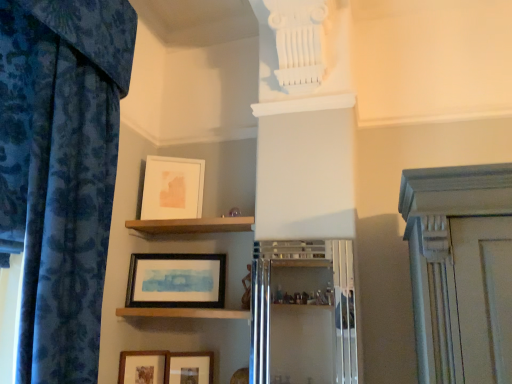
This screenshot has height=384, width=512. Describe the element at coordinates (190, 368) in the screenshot. I see `wooden framed picture at lower center, positioned as the 3th picture frame in top-to-bottom order` at that location.

You are a GUI agent. You are given a task and a screenshot of the screen. Output one action in this format:
    pyautogui.click(x=<x>, y=<y>)
    Task: Click on the wooden framed picture at lower center, positioned as the 3th picture frame in top-to-bottom order
    The height and width of the screenshot is (384, 512).
    Given the screenshot: What is the action you would take?
    pyautogui.click(x=190, y=368)

Identify the location of wooden shelf at center, arranged as the 2th shelf when viewed from the top. The height and width of the screenshot is (384, 512). (184, 313).

What do you see at coordinates (172, 188) in the screenshot? The image size is (512, 384). I see `matte white picture frame at upper center, the fourth picture frame positioned from the bottom` at bounding box center [172, 188].

What do you see at coordinates (143, 367) in the screenshot? The image size is (512, 384). I see `wooden matte picture frame at lower left, the first picture frame when ordered from bottom to top` at bounding box center [143, 367].

Describe the element at coordinates (176, 281) in the screenshot. The width and height of the screenshot is (512, 384). I see `black matte picture frame at lower center, the 3th picture frame ordered from the bottom` at that location.

Locate an element on the screen. The image size is (512, 384). blue floral fabric curtain at left is located at coordinates (61, 171).

Where is `wooden framed picture at lower center, positioned as the 3th picture frame in top-to-bottom order`? wooden framed picture at lower center, positioned as the 3th picture frame in top-to-bottom order is located at coordinates (190, 368).

Where is `curtain to the left of wooden matte picture frame at lower left, the 4th picture frame when ordered from top to bottom`? This screenshot has height=384, width=512. curtain to the left of wooden matte picture frame at lower left, the 4th picture frame when ordered from top to bottom is located at coordinates (61, 171).

Is there a large distance between wooden matte picture frame at lower left, the 4th picture frame when ordered from top to bottom, and blue floral fabric curtain at left?

No, wooden matte picture frame at lower left, the 4th picture frame when ordered from top to bottom, is not far away from blue floral fabric curtain at left.

Is wooden matte picture frame at lower left, the 4th picture frame when ordered from top to bottom, turned away from blue floral fabric curtain at left?

No, wooden matte picture frame at lower left, the 4th picture frame when ordered from top to bottom, is not facing the opposite direction of blue floral fabric curtain at left.

From the image's perspective, which object appears higher, wooden matte picture frame at lower left, the first picture frame when ordered from bottom to top, or blue floral fabric curtain at left?

blue floral fabric curtain at left, from the image's perspective.

Does point (117, 38) come in front of point (226, 316)?

Yes.

From a real-world perspective, is blue floral fabric curtain at left physically above wooden shelf at center, arranged as the 2th shelf when viewed from the top?

Yes, from a real-world perspective, blue floral fabric curtain at left is on top of wooden shelf at center, arranged as the 2th shelf when viewed from the top.

Considering the relative sizes of blue floral fabric curtain at left and wooden shelf at center, arranged as the 2th shelf when viewed from the top, in the image provided, is blue floral fabric curtain at left wider than wooden shelf at center, arranged as the 2th shelf when viewed from the top,?

Indeed, blue floral fabric curtain at left has a greater width compared to wooden shelf at center, arranged as the 2th shelf when viewed from the top.

Is blue floral fabric curtain at left touching wooden shelf at center, marked as the 1th shelf in a bottom-to-top arrangement?

No, blue floral fabric curtain at left is not next to wooden shelf at center, marked as the 1th shelf in a bottom-to-top arrangement.

Consider the image. Is blue floral fabric curtain at left turned away from metallic silver cabinet at center?

No.

From a real-world perspective, is blue floral fabric curtain at left positioned over metallic silver cabinet at center based on gravity?

Yes.

In the image, there is a blue floral fabric curtain at left. In order to click on cabinetry below it (from the image's perspective) in this screenshot , I will do `click(303, 313)`.

Considering their positions, is blue floral fabric curtain at left located in front of or behind metallic silver cabinet at center?

blue floral fabric curtain at left is in front of metallic silver cabinet at center.

Is black matte picture frame at lower center, which is counted as the 2th picture frame, starting from the top, smaller than metallic silver cabinet at center?

Indeed, black matte picture frame at lower center, which is counted as the 2th picture frame, starting from the top, has a smaller size compared to metallic silver cabinet at center.

Considering the relative sizes of black matte picture frame at lower center, which is counted as the 2th picture frame, starting from the top, and metallic silver cabinet at center in the image provided, is black matte picture frame at lower center, which is counted as the 2th picture frame, starting from the top, thinner than metallic silver cabinet at center?

In fact, black matte picture frame at lower center, which is counted as the 2th picture frame, starting from the top, might be wider than metallic silver cabinet at center.

From the image's perspective, relative to metallic silver cabinet at center, is black matte picture frame at lower center, the 3th picture frame ordered from the bottom, above or below?

black matte picture frame at lower center, the 3th picture frame ordered from the bottom, is above metallic silver cabinet at center.

Which object is further away from the camera, black matte picture frame at lower center, the 3th picture frame ordered from the bottom, or metallic silver cabinet at center?

black matte picture frame at lower center, the 3th picture frame ordered from the bottom, is behind.

You are a GUI agent. You are given a task and a screenshot of the screen. Output one action in this format:
    pyautogui.click(x=<x>, y=<y>)
    Task: Click on the shelf that is the 2nd object to the left of the metallic silver cabinet at center, starting at the anchor
    
    Given the screenshot: What is the action you would take?
    pyautogui.click(x=184, y=313)

Is point (167, 315) behind point (332, 244)?

Yes, point (167, 315) is farther from viewer.

From a real-world perspective, between wooden shelf at center, arranged as the 2th shelf when viewed from the top, and metallic silver cabinet at center, who is vertically higher?

In real-world perspective, metallic silver cabinet at center is above.

Could you measure the distance between wooden shelf at center, arranged as the 2th shelf when viewed from the top, and metallic silver cabinet at center?

wooden shelf at center, arranged as the 2th shelf when viewed from the top, and metallic silver cabinet at center are 13.30 inches apart.

Which object is positioned more to the right, black matte picture frame at lower center, which is counted as the 2th picture frame, starting from the top, or wooden matte picture frame at lower left, the 4th picture frame when ordered from top to bottom?

Positioned to the right is black matte picture frame at lower center, which is counted as the 2th picture frame, starting from the top.

Between black matte picture frame at lower center, which is counted as the 2th picture frame, starting from the top, and wooden matte picture frame at lower left, the 4th picture frame when ordered from top to bottom, which one is positioned behind?

black matte picture frame at lower center, which is counted as the 2th picture frame, starting from the top, is further from the camera.

Is wooden matte picture frame at lower left, the first picture frame when ordered from bottom to top, located within black matte picture frame at lower center, the 3th picture frame ordered from the bottom?

No, wooden matte picture frame at lower left, the first picture frame when ordered from bottom to top, is not surrounded by black matte picture frame at lower center, the 3th picture frame ordered from the bottom.

In the scene shown: Which of these two, black matte picture frame at lower center, which is counted as the 2th picture frame, starting from the top, or wooden matte picture frame at lower left, the first picture frame when ordered from bottom to top, is smaller?

wooden matte picture frame at lower left, the first picture frame when ordered from bottom to top, is smaller.

Consider the image. Considering the sizes of objects metallic silver cabinet at center and blue floral fabric curtain at left in the image provided, who is thinner, metallic silver cabinet at center or blue floral fabric curtain at left?

With smaller width is metallic silver cabinet at center.

Which point is more distant from viewer, (343, 259) or (95, 133)?

The point (343, 259) is farther.

Can you see metallic silver cabinet at center touching blue floral fabric curtain at left?

metallic silver cabinet at center and blue floral fabric curtain at left are clearly separated.

This screenshot has width=512, height=384. Identify the location of the 2nd picture frame behind the blue floral fabric curtain at left, starting your count from the anchor. (143, 367).

Find the location of a particular element. The height and width of the screenshot is (384, 512). curtain in front of the wooden shelf at center, arranged as the 2th shelf when viewed from the top is located at coordinates (61, 171).

Based on the photo, from the image, which object appears to be nearer to metallic silver cabinet at center, matte white picture frame at upper center, the fourth picture frame positioned from the bottom, or wooden framed picture at lower center, positioned as the 3th picture frame in top-to-bottom order?

wooden framed picture at lower center, positioned as the 3th picture frame in top-to-bottom order, is positioned closer to the anchor metallic silver cabinet at center.

Estimate the real-world distances between objects in this image. Which object is further from blue floral fabric curtain at left, matte white picture frame at upper center, which is the 1th picture frame from top to bottom, or wooden framed picture at lower center, positioned as the 3th picture frame in top-to-bottom order?

wooden framed picture at lower center, positioned as the 3th picture frame in top-to-bottom order, lies further to blue floral fabric curtain at left than the other object.

Looking at the image, which one is located closer to black matte picture frame at lower center, the 3th picture frame ordered from the bottom, wooden framed picture at lower center, positioned as the 3th picture frame in top-to-bottom order, or brown wooden shelf at upper center, which is counted as the 2th shelf, starting from the bottom?

The object closer to black matte picture frame at lower center, the 3th picture frame ordered from the bottom, is brown wooden shelf at upper center, which is counted as the 2th shelf, starting from the bottom.

Looking at the image, which one is located closer to brown wooden shelf at upper center, which is counted as the 2th shelf, starting from the bottom, blue floral fabric curtain at left or wooden matte picture frame at lower left, the 4th picture frame when ordered from top to bottom?

Among the two, wooden matte picture frame at lower left, the 4th picture frame when ordered from top to bottom, is located nearer to brown wooden shelf at upper center, which is counted as the 2th shelf, starting from the bottom.

Which object lies nearer to the anchor point wooden shelf at center, marked as the 1th shelf in a bottom-to-top arrangement, wooden matte picture frame at lower left, the first picture frame when ordered from bottom to top, or blue floral fabric curtain at left?

wooden matte picture frame at lower left, the first picture frame when ordered from bottom to top, lies closer to wooden shelf at center, marked as the 1th shelf in a bottom-to-top arrangement, than the other object.

In the scene shown: Looking at the image, which one is located further to wooden matte picture frame at lower left, the 4th picture frame when ordered from top to bottom, brown wooden shelf at upper center, which is the first shelf in top-to-bottom order, or matte white picture frame at upper center, the fourth picture frame positioned from the bottom?

Among the two, matte white picture frame at upper center, the fourth picture frame positioned from the bottom, is located further to wooden matte picture frame at lower left, the 4th picture frame when ordered from top to bottom.

Which object lies nearer to the anchor point wooden shelf at center, arranged as the 2th shelf when viewed from the top, matte white picture frame at upper center, the fourth picture frame positioned from the bottom, or black matte picture frame at lower center, which is counted as the 2th picture frame, starting from the top?

Among the two, black matte picture frame at lower center, which is counted as the 2th picture frame, starting from the top, is located nearer to wooden shelf at center, arranged as the 2th shelf when viewed from the top.

Looking at the image, which one is located closer to blue floral fabric curtain at left, matte white picture frame at upper center, which is the 1th picture frame from top to bottom, or black matte picture frame at lower center, the 3th picture frame ordered from the bottom?

matte white picture frame at upper center, which is the 1th picture frame from top to bottom, lies closer to blue floral fabric curtain at left than the other object.

Identify the location of cabinetry between matte white picture frame at upper center, the fourth picture frame positioned from the bottom, and wooden matte picture frame at lower left, the 4th picture frame when ordered from top to bottom, in the up-down direction. (303, 313).

I want to click on picture frame between wooden shelf at center, marked as the 1th shelf in a bottom-to-top arrangement, and wooden matte picture frame at lower left, the 4th picture frame when ordered from top to bottom, in the vertical direction, so click(x=190, y=368).

Locate an element on the screen. shelf that lies between brown wooden shelf at upper center, which is the first shelf in top-to-bottom order, and wooden framed picture at lower center, acting as the second picture frame starting from the bottom, from top to bottom is located at coordinates (184, 313).

Locate an element on the screen. Image resolution: width=512 pixels, height=384 pixels. cabinetry between brown wooden shelf at upper center, which is counted as the 2th shelf, starting from the bottom, and wooden framed picture at lower center, positioned as the 3th picture frame in top-to-bottom order, from top to bottom is located at coordinates coord(303,313).